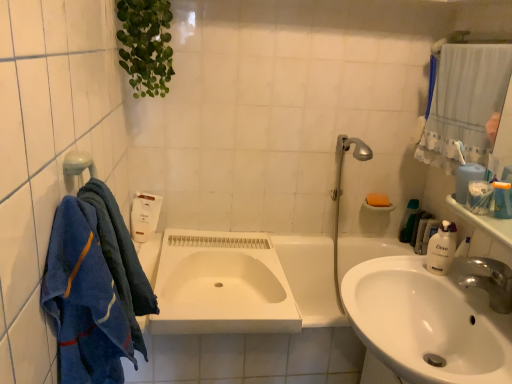
This screenshot has width=512, height=384. What do you see at coordinates (442, 248) in the screenshot?
I see `white glossy soap dispenser at right` at bounding box center [442, 248].

This screenshot has width=512, height=384. Find the location of `white plastic soap dispenser at upper right, which ranks as the second toiletry in front-to-back order`. white plastic soap dispenser at upper right, which ranks as the second toiletry in front-to-back order is located at coordinates (419, 226).

This screenshot has width=512, height=384. I want to click on green leafy plant at upper left, so click(146, 45).

Could green leafy plant at upper left be considered to be inside blue plastic cup at upper right?

No, green leafy plant at upper left is not a part of blue plastic cup at upper right.

From the image's perspective, is blue plastic cup at upper right below green leafy plant at upper left?

Yes, from the image's perspective, blue plastic cup at upper right is beneath green leafy plant at upper left.

Can you confirm if blue plastic cup at upper right is shorter than green leafy plant at upper left?

Correct, blue plastic cup at upper right is not as tall as green leafy plant at upper left.

Considering their positions, is white textured mirror at upper right located in front of or behind blue plastic cup at upper right?

Clearly, white textured mirror at upper right is behind blue plastic cup at upper right.

Does white textured mirror at upper right have a greater width compared to blue plastic cup at upper right?

Yes.

In the scene shown: Is white textured mirror at upper right taller than blue plastic cup at upper right?

Correct, white textured mirror at upper right is much taller as blue plastic cup at upper right.

From the image's perspective, which is below, white textured mirror at upper right or blue plastic cup at upper right?

blue plastic cup at upper right.

What are the coordinates of `mirror on the right of the orange sponge at upper right` in the screenshot? It's located at (463, 102).

Considering the sizes of objects orange sponge at upper right and white textured mirror at upper right in the image provided, who is smaller, orange sponge at upper right or white textured mirror at upper right?

With smaller size is orange sponge at upper right.

Looking at this image, from the image's perspective, does orange sponge at upper right appear lower than white textured mirror at upper right?

Correct, orange sponge at upper right appears lower than white textured mirror at upper right in the image.

In terms of height, does orange sponge at upper right look taller or shorter compared to white textured mirror at upper right?

orange sponge at upper right is shorter than white textured mirror at upper right.

How different are the orientations of white glossy sink at lower right, which is the second sink from back to front, and white plastic soap dispenser at upper right, which ranks as the second toiletry in front-to-back order, in degrees?

They differ by 89 degrees in their facing directions.

Considering the positions of point (387, 263) and point (413, 246), is point (387, 263) closer or farther from the camera than point (413, 246)?

Point (387, 263) is closer to the camera than point (413, 246).

Does white glossy sink at lower right, the 2th sink when ordered from left to right, come in front of white plastic soap dispenser at upper right, the 3th toiletry when ordered from left to right?

Yes, the depth of white glossy sink at lower right, the 2th sink when ordered from left to right, is less than that of white plastic soap dispenser at upper right, the 3th toiletry when ordered from left to right.

This screenshot has width=512, height=384. In order to click on sink above the white plastic soap dispenser at upper right, acting as the first toiletry starting from the right (from a real-world perspective) in this screenshot , I will do `click(426, 323)`.

Is white matte sink at center, the first sink when ordered from left to right, oriented towards blue plastic cup at upper right?

No, white matte sink at center, the first sink when ordered from left to right, is not facing towards blue plastic cup at upper right.

Considering the positions of objects white matte sink at center, acting as the second sink starting from the right, and blue plastic cup at upper right in the image provided, who is in front, white matte sink at center, acting as the second sink starting from the right, or blue plastic cup at upper right?

blue plastic cup at upper right is in front.

Can we say white matte sink at center, acting as the second sink starting from the right, lies outside blue plastic cup at upper right?

Absolutely, white matte sink at center, acting as the second sink starting from the right, is external to blue plastic cup at upper right.

Is white matte sink at center, which is counted as the 1th sink, starting from the back, to the left or to the right of blue plastic cup at upper right in the image?

From the image, it's evident that white matte sink at center, which is counted as the 1th sink, starting from the back, is to the left of blue plastic cup at upper right.

Which is more to the right, white glossy soap dispenser at right or white textured mirror at upper right?

white textured mirror at upper right is more to the right.

Is white glossy soap dispenser at right outside of white textured mirror at upper right?

Indeed, white glossy soap dispenser at right is completely outside white textured mirror at upper right.

Is white glossy soap dispenser at right aimed at white textured mirror at upper right?

No, white glossy soap dispenser at right is not aimed at white textured mirror at upper right.

Considering their positions, is white glossy soap dispenser at right located in front of or behind white textured mirror at upper right?

white glossy soap dispenser at right is in front of white textured mirror at upper right.

Is point (462, 171) more distant than point (371, 157)?

No.

Considering the sizes of objects blue plastic container at upper right, which is the 1th toiletry from left to right, and silver metallic showerhead at upper right in the image provided, who is wider, blue plastic container at upper right, which is the 1th toiletry from left to right, or silver metallic showerhead at upper right?

silver metallic showerhead at upper right is wider.

Who is taller, blue plastic container at upper right, which is the 1th toiletry from left to right, or silver metallic showerhead at upper right?

silver metallic showerhead at upper right is taller.

Is there a large distance between blue plastic container at upper right, which is the 1th toiletry from left to right, and silver metallic showerhead at upper right?

blue plastic container at upper right, which is the 1th toiletry from left to right, is actually quite close to silver metallic showerhead at upper right.

Locate an element on the screen. mouthwash in front of the green leafy plant at upper left is located at coordinates (479, 197).

In the image, there is a white textured mirror at upper right. Where is `mouthwash below it (from a real-world perspective)`? mouthwash below it (from a real-world perspective) is located at coordinates (479, 197).

Which object lies further to the anchor point white glossy soap dispenser at right, blue cotton towel at left, acting as the 1th bath towel starting from the front, or blue plastic container at upper right, the first toiletry when ordered from front to back?

Based on the image, blue cotton towel at left, acting as the 1th bath towel starting from the front, appears to be further to white glossy soap dispenser at right.

Estimate the real-world distances between objects in this image. Which object is further from silver metallic showerhead at upper right, white glossy soap dispenser at right or blue terry cloth towel at left, marked as the 1th bath towel in a back-to-front arrangement?

blue terry cloth towel at left, marked as the 1th bath towel in a back-to-front arrangement, lies further to silver metallic showerhead at upper right than the other object.

Which object lies further to the anchor point white glossy countertop at upper right, blue plastic cup at upper right or white glossy sink at lower right, which is the second sink from back to front?

The object further to white glossy countertop at upper right is white glossy sink at lower right, which is the second sink from back to front.

When comparing their distances from orange sponge at upper right, does blue terry cloth towel at left, the second bath towel when ordered from front to back, or white glossy countertop at upper right seem closer?

white glossy countertop at upper right is closer to orange sponge at upper right.

Based on their spatial positions, is blue cotton towel at left, marked as the second bath towel in a back-to-front arrangement, or blue plastic container at upper right, which is the third toiletry from back to front, closer to orange sponge at upper right?

blue plastic container at upper right, which is the third toiletry from back to front.

Looking at the image, which one is located further to white glossy countertop at upper right, white plastic soap dispenser at upper right, which ranks as the second toiletry in front-to-back order, or blue cotton towel at left, acting as the 1th bath towel starting from the front?

The object further to white glossy countertop at upper right is blue cotton towel at left, acting as the 1th bath towel starting from the front.

Looking at the image, which one is located closer to silver metallic showerhead at upper right, white glossy countertop at upper right or white plastic soap dispenser at upper right, which ranks as the second toiletry in front-to-back order?

white plastic soap dispenser at upper right, which ranks as the second toiletry in front-to-back order, lies closer to silver metallic showerhead at upper right than the other object.

In the scene shown: Looking at the image, which one is located closer to silver metallic showerhead at upper right, green plastic bottle at right, which is counted as the second toiletry, starting from the right, or white glossy sink at lower right, the first sink viewed from the right?

Based on the image, green plastic bottle at right, which is counted as the second toiletry, starting from the right, appears to be nearer to silver metallic showerhead at upper right.

Find the location of a particular element. soap dispenser located between white matte sink at center, the first sink when ordered from left to right, and blue plastic cup at upper right in the left-right direction is located at coordinates (442, 248).

Find the location of a particular element. Image resolution: width=512 pixels, height=384 pixels. counter top located between white matte sink at center, acting as the second sink starting from the right, and white textured mirror at upper right in the left-right direction is located at coordinates (484, 222).

You are a GUI agent. You are given a task and a screenshot of the screen. Output one action in this format:
    pyautogui.click(x=<x>, y=<y>)
    Task: Click on the soap between white matte sink at center, acting as the second sink starting from the right, and white glossy soap dispenser at right from left to right
    
    Given the screenshot: What is the action you would take?
    pyautogui.click(x=378, y=200)

At what (x,y) coordinates should I click in order to perform the action: click on bath towel located between white glossy sink at lower right, which is the second sink from back to front, and white plastic soap dispenser at upper right, acting as the first toiletry starting from the right, in the depth direction. Please return your answer as a coordinate pair (x, y). This screenshot has width=512, height=384. Looking at the image, I should click on (121, 258).